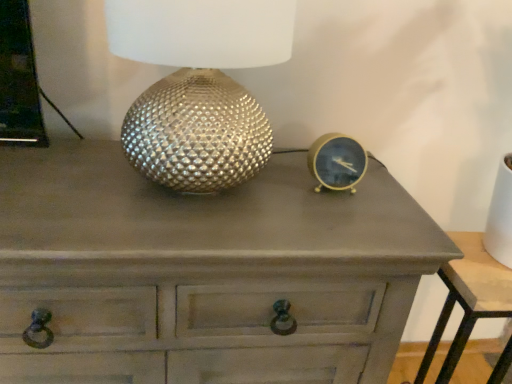
This screenshot has width=512, height=384. I want to click on vacant space situated on the left part of gold metallic clock at right, so click(263, 193).